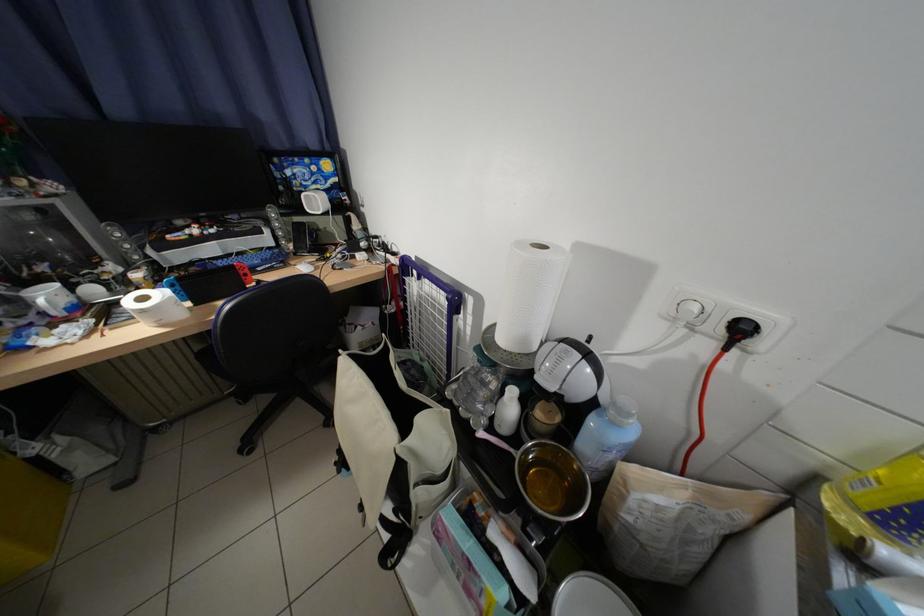
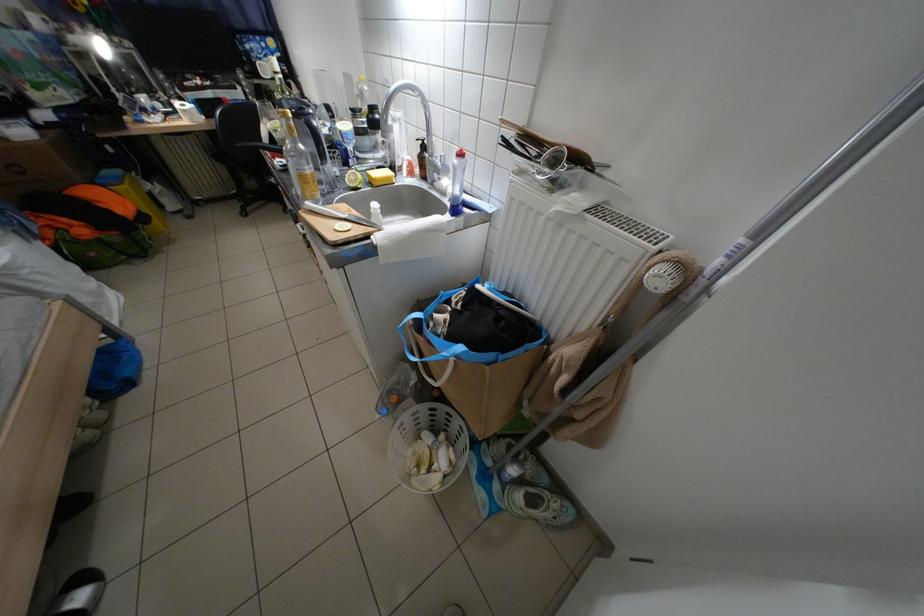
From the picture: In a continuous first-person perspective shot, in which direction is the camera moving?

The movement direction of the cameraman is right, backward.